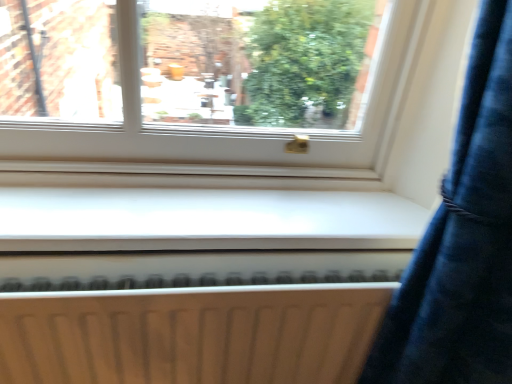
This screenshot has height=384, width=512. What do you see at coordinates (205, 219) in the screenshot? I see `white smooth window sill at center` at bounding box center [205, 219].

Find the location of a particular element. The height and width of the screenshot is (384, 512). white smooth window sill at center is located at coordinates (205, 219).

Image resolution: width=512 pixels, height=384 pixels. I want to click on white matte radiator at lower center, so pyautogui.click(x=191, y=334).

Describe the element at coordinates (191, 334) in the screenshot. The width and height of the screenshot is (512, 384). I see `white matte radiator at lower center` at that location.

The image size is (512, 384). Find the location of `white smooth window sill at center`. white smooth window sill at center is located at coordinates (205, 219).

Considering the positions of objects white matte radiator at lower center and white smooth window sill at center in the image provided, who is more to the left, white matte radiator at lower center or white smooth window sill at center?

white matte radiator at lower center.

Does white matte radiator at lower center lie behind white smooth window sill at center?

No, white matte radiator at lower center is in front of white smooth window sill at center.

Is point (180, 303) less distant than point (17, 209)?

Yes, point (180, 303) is closer to viewer.

In the scene shown: From the image's perspective, is white matte radiator at lower center located above or below white smooth window sill at center?

Based on their image positions, white matte radiator at lower center is located beneath white smooth window sill at center.

In the scene shown: From a real-world perspective, between white matte radiator at lower center and white smooth window sill at center, who is vertically lower?

white matte radiator at lower center, from a real-world perspective.

Considering the sizes of objects white matte radiator at lower center and white smooth window sill at center in the image provided, who is wider, white matte radiator at lower center or white smooth window sill at center?

Wider between the two is white smooth window sill at center.

Considering the sizes of objects white matte radiator at lower center and white smooth window sill at center in the image provided, who is taller, white matte radiator at lower center or white smooth window sill at center?

Standing taller between the two is white matte radiator at lower center.

Considering the sizes of objects white matte radiator at lower center and white smooth window sill at center in the image provided, who is smaller, white matte radiator at lower center or white smooth window sill at center?

white smooth window sill at center.

Can we say white matte radiator at lower center lies outside white smooth window sill at center?

white matte radiator at lower center is positioned outside white smooth window sill at center.

Is white matte radiator at lower center next to white smooth window sill at center and touching it?

No, white matte radiator at lower center is not next to white smooth window sill at center.

Is white matte radiator at lower center aimed at white smooth window sill at center?

No, white matte radiator at lower center is not aimed at white smooth window sill at center.

How different are the orientations of white matte radiator at lower center and white smooth window sill at center in degrees?

0.00641 degrees.

You are a GUI agent. You are given a task and a screenshot of the screen. Output one action in this format:
    pyautogui.click(x=<x>, y=<y>)
    Task: Click on the window sill on the right of white matte radiator at lower center
    
    Given the screenshot: What is the action you would take?
    pyautogui.click(x=205, y=219)

Does white smooth window sill at center appear on the left side of white matte radiator at lower center?

No, white smooth window sill at center is not to the left of white matte radiator at lower center.

Which object is closer to the camera, white smooth window sill at center or white matte radiator at lower center?

white matte radiator at lower center.

Considering the points (335, 224) and (14, 312), which point is behind, point (335, 224) or point (14, 312)?

The point (335, 224) is farther from the camera.

From the image's perspective, which one is positioned lower, white smooth window sill at center or white matte radiator at lower center?

From the image's view, white matte radiator at lower center is below.

From a real-world perspective, is white smooth window sill at center over white matte radiator at lower center?

Yes.

Considering the sizes of objects white smooth window sill at center and white matte radiator at lower center in the image provided, who is thinner, white smooth window sill at center or white matte radiator at lower center?

white matte radiator at lower center is thinner.

In terms of height, does white smooth window sill at center look taller or shorter compared to white matte radiator at lower center?

In the image, white smooth window sill at center appears to be shorter than white matte radiator at lower center.

Who is smaller, white smooth window sill at center or white matte radiator at lower center?

white smooth window sill at center.

Is white smooth window sill at center completely or partially outside of white matte radiator at lower center?

Yes, white smooth window sill at center is not within white matte radiator at lower center.

Is white smooth window sill at center beside white matte radiator at lower center?

white smooth window sill at center and white matte radiator at lower center are not in contact.

Does white smooth window sill at center turn towards white matte radiator at lower center?

No.

How far apart are white smooth window sill at center and white matte radiator at lower center?

6.43 inches.

Locate an element on the screen. The width and height of the screenshot is (512, 384). radiator that appears on the left of white smooth window sill at center is located at coordinates (191, 334).

Find the location of a particular element. This screenshot has height=384, width=512. window sill located above the white matte radiator at lower center (from a real-world perspective) is located at coordinates (205, 219).

Locate an element on the screen. This screenshot has height=384, width=512. window sill to the right of white matte radiator at lower center is located at coordinates (205, 219).